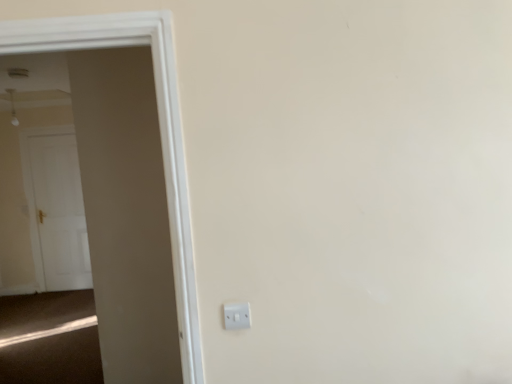
What do you see at coordinates (237, 316) in the screenshot? I see `white plastic electric outlet at lower center` at bounding box center [237, 316].

Measure the distance between white wooden door at left, which appears as the 1th door when viewed from the front, and camera.

white wooden door at left, which appears as the 1th door when viewed from the front, and camera are 4.27 feet apart.

Image resolution: width=512 pixels, height=384 pixels. In order to click on white plastic electric outlet at lower center in this screenshot , I will do [x=237, y=316].

Does white plastic electric outlet at lower center come behind white wooden door at left, which is the second door from left to right?

Yes.

Who is smaller, white plastic electric outlet at lower center or white wooden door at left, which is the second door from left to right?

With smaller size is white plastic electric outlet at lower center.

Is there a large distance between white plastic electric outlet at lower center and white wooden door at left, which is the 2th door in back-to-front order?

Actually, white plastic electric outlet at lower center and white wooden door at left, which is the 2th door in back-to-front order, are a little close together.

From the image's perspective, does white wooden door at left, which is the second door from left to right, appear higher than white glossy door at left, the second door when ordered from right to left?

Yes.

Is white wooden door at left, which is the 2th door in back-to-front order, in contact with white glossy door at left, which is the 1th door in back-to-front order?

No, white wooden door at left, which is the 2th door in back-to-front order, is not next to white glossy door at left, which is the 1th door in back-to-front order.

Does white wooden door at left, which is the second door from left to right, have a lesser width compared to white glossy door at left, which is the 1th door in back-to-front order?

No.

Considering the sizes of objects white wooden door at left, which is the 2th door in back-to-front order, and white glossy door at left, placed as the first door when sorted from left to right, in the image provided, who is shorter, white wooden door at left, which is the 2th door in back-to-front order, or white glossy door at left, placed as the first door when sorted from left to right,?

With less height is white wooden door at left, which is the 2th door in back-to-front order.

Is white plastic electric outlet at lower center located outside white glossy door at left, the second door positioned from the front?

Absolutely, white plastic electric outlet at lower center is external to white glossy door at left, the second door positioned from the front.

Visually, is white plastic electric outlet at lower center positioned to the left or to the right of white glossy door at left, the second door positioned from the front?

white plastic electric outlet at lower center is positioned on white glossy door at left, the second door positioned from the front,'s right side.

Is white plastic electric outlet at lower center touching white glossy door at left, which is the 1th door in back-to-front order?

white plastic electric outlet at lower center is not next to white glossy door at left, which is the 1th door in back-to-front order, and they're not touching.

Looking at their sizes, would you say white plastic electric outlet at lower center is wider or thinner than white glossy door at left, which is the 1th door in back-to-front order?

Clearly, white plastic electric outlet at lower center has less width compared to white glossy door at left, which is the 1th door in back-to-front order.

From a real-world perspective, which is physically below, white glossy door at left, the second door positioned from the front, or white plastic electric outlet at lower center?

From a 3D spatial view, white glossy door at left, the second door positioned from the front, is below.

Considering the relative sizes of white glossy door at left, the second door when ordered from right to left, and white plastic electric outlet at lower center in the image provided, is white glossy door at left, the second door when ordered from right to left, thinner than white plastic electric outlet at lower center?

No.

Is white glossy door at left, the second door positioned from the front, positioned with its back to white plastic electric outlet at lower center?

No.

Considering the sizes of objects white glossy door at left, which is the 1th door in back-to-front order, and white wooden door at left, which appears as the 1th door when viewed from the front, in the image provided, who is bigger, white glossy door at left, which is the 1th door in back-to-front order, or white wooden door at left, which appears as the 1th door when viewed from the front,?

white wooden door at left, which appears as the 1th door when viewed from the front.

From a real-world perspective, is white glossy door at left, placed as the first door when sorted from left to right, under white wooden door at left, which appears as the 1th door when viewed from the front?

Yes.

Could you tell me if white glossy door at left, the second door when ordered from right to left, is facing white wooden door at left, which is the 2th door in back-to-front order?

No.

Is white glossy door at left, placed as the first door when sorted from left to right, not inside white wooden door at left, which appears as the first door when viewed from the right?

That's correct, white glossy door at left, placed as the first door when sorted from left to right, is outside of white wooden door at left, which appears as the first door when viewed from the right.

Is white wooden door at left, which is the second door from left to right, looking in the opposite direction of white plastic electric outlet at lower center?

white wooden door at left, which is the second door from left to right, is not turned away from white plastic electric outlet at lower center.

Is white wooden door at left, which appears as the 1th door when viewed from the front, positioned before white plastic electric outlet at lower center?

Yes, the depth of white wooden door at left, which appears as the 1th door when viewed from the front, is less than that of white plastic electric outlet at lower center.

Is white wooden door at left, which appears as the first door when viewed from the right, next to white plastic electric outlet at lower center?

white wooden door at left, which appears as the first door when viewed from the right, and white plastic electric outlet at lower center are clearly separated.

Consider the image. Considering the sizes of white wooden door at left, which appears as the first door when viewed from the right, and white plastic electric outlet at lower center in the image, is white wooden door at left, which appears as the first door when viewed from the right, wider or thinner than white plastic electric outlet at lower center?

white wooden door at left, which appears as the first door when viewed from the right, is wider than white plastic electric outlet at lower center.

You are a GUI agent. You are given a task and a screenshot of the screen. Output one action in this format:
    pyautogui.click(x=<x>, y=<y>)
    Task: Click on the door above the white plastic electric outlet at lower center (from a real-world perspective)
    
    Given the screenshot: What is the action you would take?
    pyautogui.click(x=159, y=127)

Locate an element on the screen. Image resolution: width=512 pixels, height=384 pixels. door that is on the right side of white glossy door at left, placed as the first door when sorted from left to right is located at coordinates (159, 127).

In the scene shown: When comparing their distances from white glossy door at left, the second door positioned from the front, does white plastic electric outlet at lower center or white wooden door at left, which appears as the first door when viewed from the right, seem closer?

white wooden door at left, which appears as the first door when viewed from the right, is positioned closer to the anchor white glossy door at left, the second door positioned from the front.

Looking at the image, which one is located further to white wooden door at left, which is the 2th door in back-to-front order, white plastic electric outlet at lower center or white glossy door at left, the second door positioned from the front?

white glossy door at left, the second door positioned from the front, is further to white wooden door at left, which is the 2th door in back-to-front order.

Which object lies nearer to the anchor point white plastic electric outlet at lower center, white wooden door at left, which is the 2th door in back-to-front order, or white glossy door at left, placed as the first door when sorted from left to right?

Among the two, white wooden door at left, which is the 2th door in back-to-front order, is located nearer to white plastic electric outlet at lower center.

Considering their positions, is white glossy door at left, the second door when ordered from right to left, positioned further to white wooden door at left, which appears as the 1th door when viewed from the front, than white plastic electric outlet at lower center?

white glossy door at left, the second door when ordered from right to left.

Based on their spatial positions, is white glossy door at left, which is the 1th door in back-to-front order, or white wooden door at left, which appears as the 1th door when viewed from the front, closer to white plastic electric outlet at lower center?

white wooden door at left, which appears as the 1th door when viewed from the front, is closer to white plastic electric outlet at lower center.

Looking at this image, estimate the real-world distances between objects in this image. Which object is closer to white glossy door at left, placed as the first door when sorted from left to right, white wooden door at left, which is the 2th door in back-to-front order, or white plastic electric outlet at lower center?

Among the two, white wooden door at left, which is the 2th door in back-to-front order, is located nearer to white glossy door at left, placed as the first door when sorted from left to right.

Where is `electric outlet positioned between white wooden door at left, which appears as the 1th door when viewed from the front, and white glossy door at left, which is the 1th door in back-to-front order, from near to far`? electric outlet positioned between white wooden door at left, which appears as the 1th door when viewed from the front, and white glossy door at left, which is the 1th door in back-to-front order, from near to far is located at coordinates (237, 316).